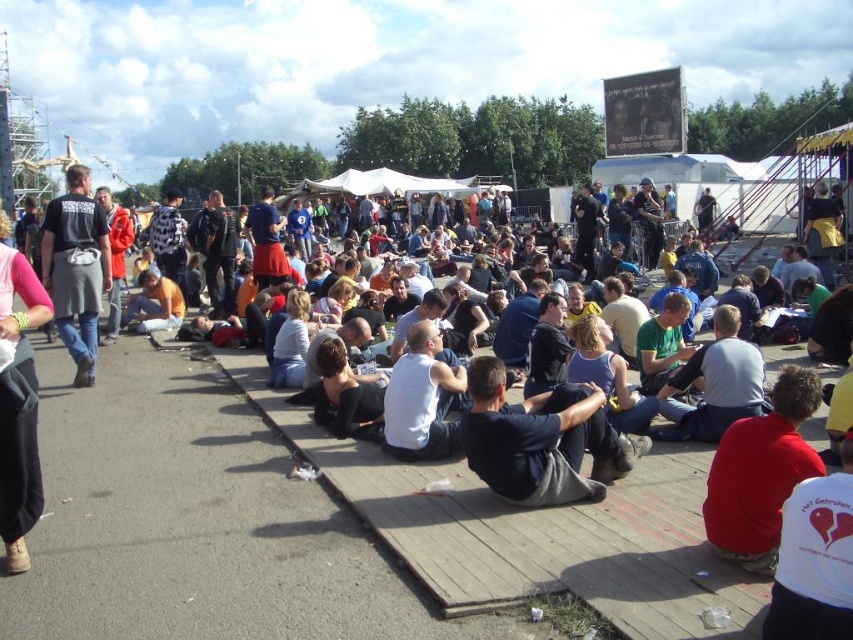
Question: Can you confirm if dark blue fabric at center is thinner than black fabric shirt at left?

Choices:
 (A) yes
 (B) no

Answer: (A)

Question: Which of the following is the farthest from the observer?

Choices:
 (A) (705, 524)
 (B) (79, 362)
 (C) (566, 420)
 (D) (393, 438)

Answer: (B)

Question: Which object appears closest to the camera in this image?

Choices:
 (A) red cotton shirt at lower right
 (B) white cotton tank top at center

Answer: (A)

Question: Is red cotton shirt at lower right smaller than black fabric shirt at left?

Choices:
 (A) no
 (B) yes

Answer: (B)

Question: Does black fabric shirt at left appear over white cotton tank top at center?

Choices:
 (A) yes
 (B) no

Answer: (A)

Question: Considering the real-world distances, which object is farthest from the dark blue fabric at center?

Choices:
 (A) white cotton tank top at center
 (B) black fabric shirt at left

Answer: (B)